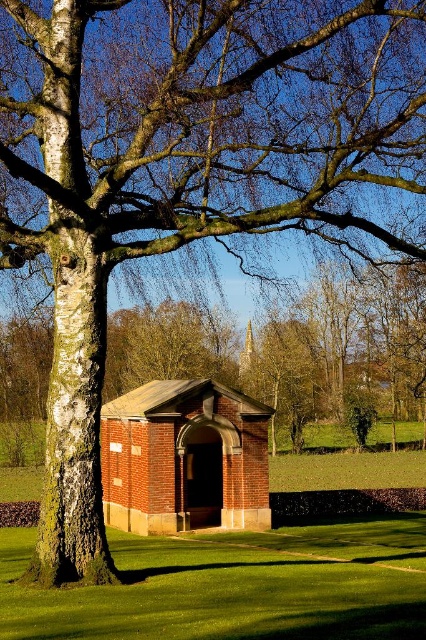
Question: From the image, what is the correct spatial relationship of green grass at lower center in relation to brick/tile hut at center?

Choices:
 (A) left
 (B) right

Answer: (B)

Question: Which point is closer to the camera taking this photo?

Choices:
 (A) (377, 586)
 (B) (247, 468)

Answer: (A)

Question: Can you confirm if green grass at lower center is positioned above brick/tile hut at center?

Choices:
 (A) yes
 (B) no

Answer: (B)

Question: Which point is farther from the camera taking this photo?

Choices:
 (A) (129, 449)
 (B) (276, 564)

Answer: (A)

Question: From the image, what is the correct spatial relationship of green grass at lower center in relation to brick/tile hut at center?

Choices:
 (A) right
 (B) left

Answer: (A)